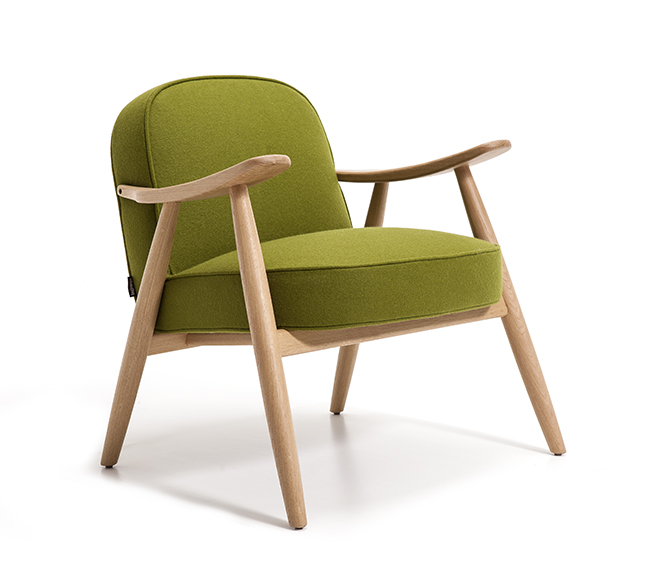
Find the location of `arm rest`. arm rest is located at coordinates (235, 173), (405, 174).